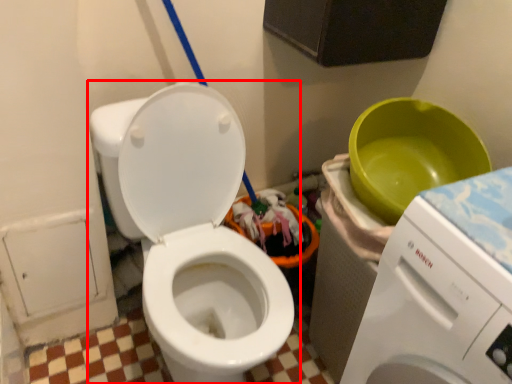
Question: From the image's perspective, where is toilet (annotated by the red box) located in relation to washing machine in the image?

Choices:
 (A) above
 (B) below

Answer: (A)